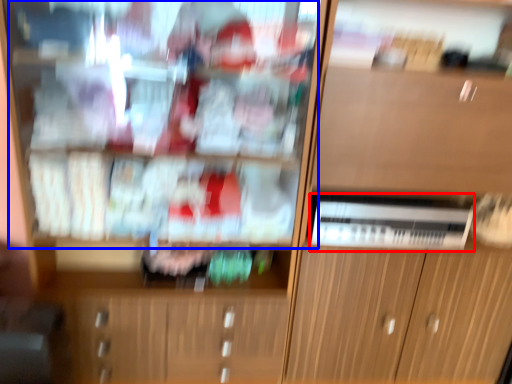
Question: Which object is further to the camera taking this photo, appliance (highlighted by a red box) or shelf (highlighted by a blue box)?

Choices:
 (A) appliance
 (B) shelf

Answer: (A)